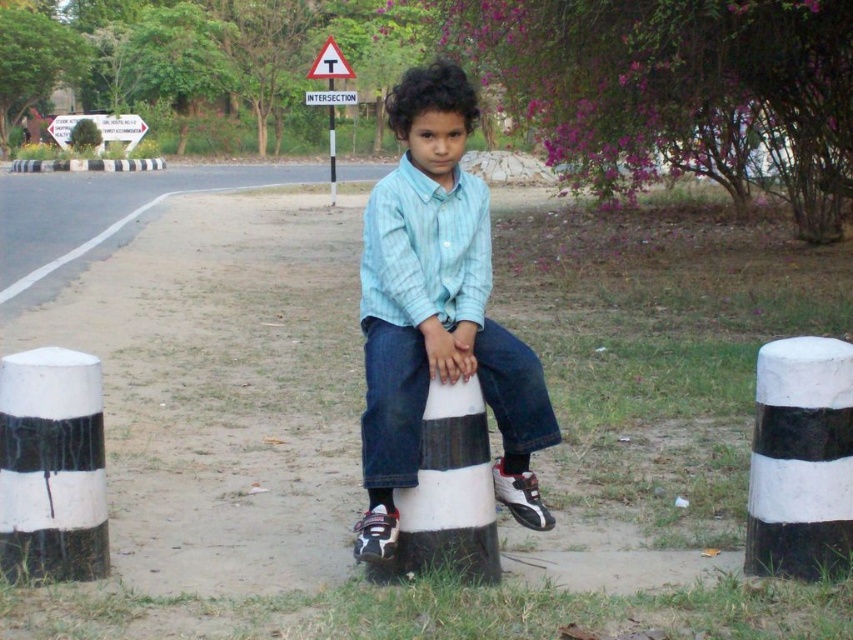
You are a delivery person who needs to place a small package on one of the objects in the scene. The package requires a stable, flat surface. Which object between the white striped cone at center and the white striped pole at center would be more suitable for placing the package?

The white striped pole at center is taller than the white striped cone at center, so the pole provides a more stable and flat surface for placing the package.

You are a pedestrian trying to cross the road and see the light blue denim shirt at center and the white plastic triangle at upper center. Which object is closer to the road edge?

The light blue denim shirt at center is positioned on the right side of the white plastic triangle at upper center, so the white plastic triangle at upper center is closer to the road edge.

You are a pedestrian trying to cross the road and see the white plastic sign at upper center and the white striped pole at center. Which object is closer to you?

The white plastic sign at upper center is closer to you because it is in front of the white striped pole at center.